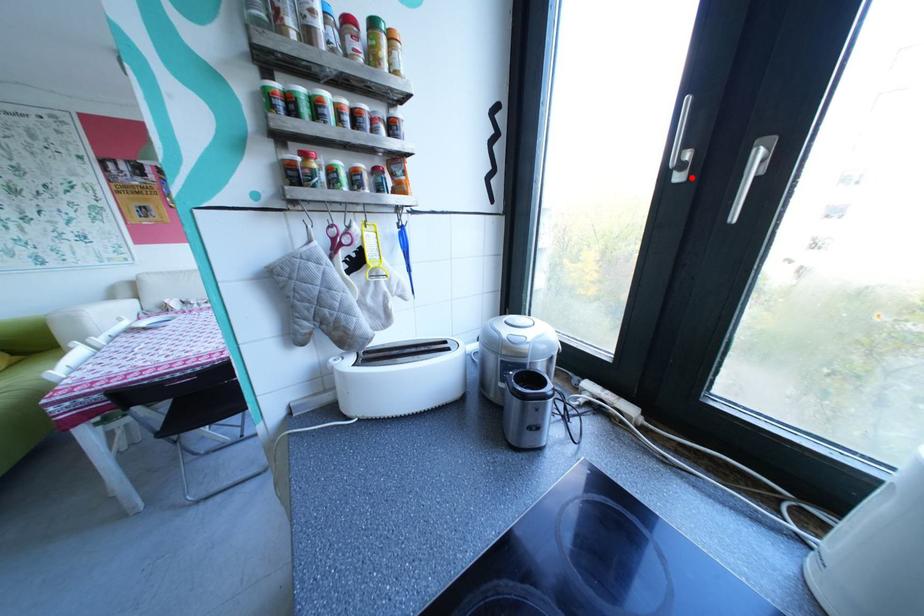
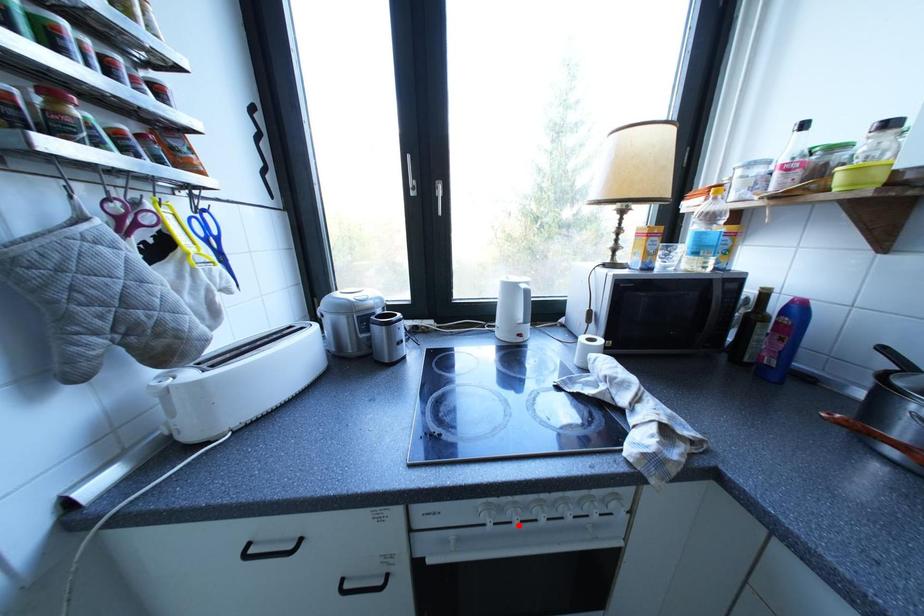
I am providing you with two images of the same scene from different viewpoints. A red point is marked on the first image and another point is marked on the second image. Is the red point in image1 aligned with the point shown in image2?

No